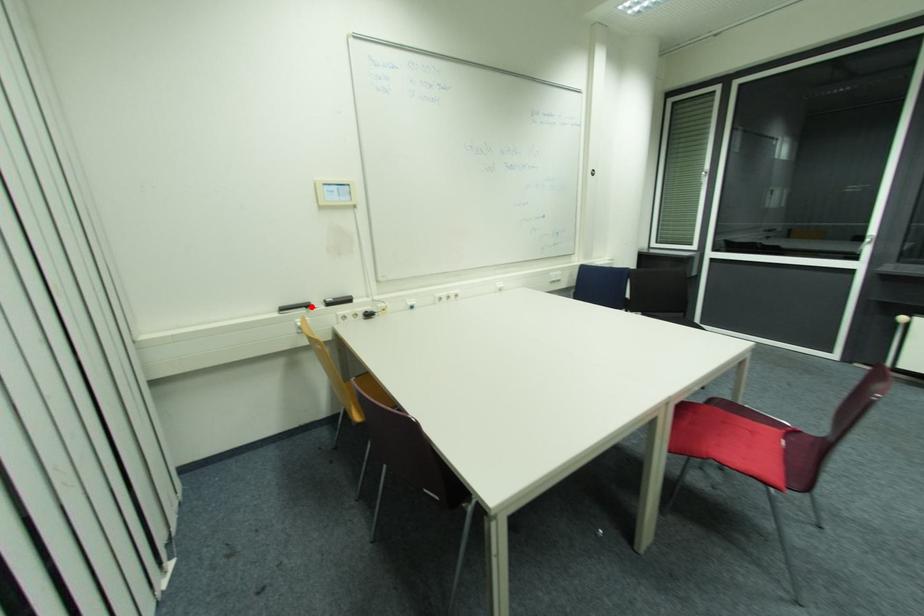
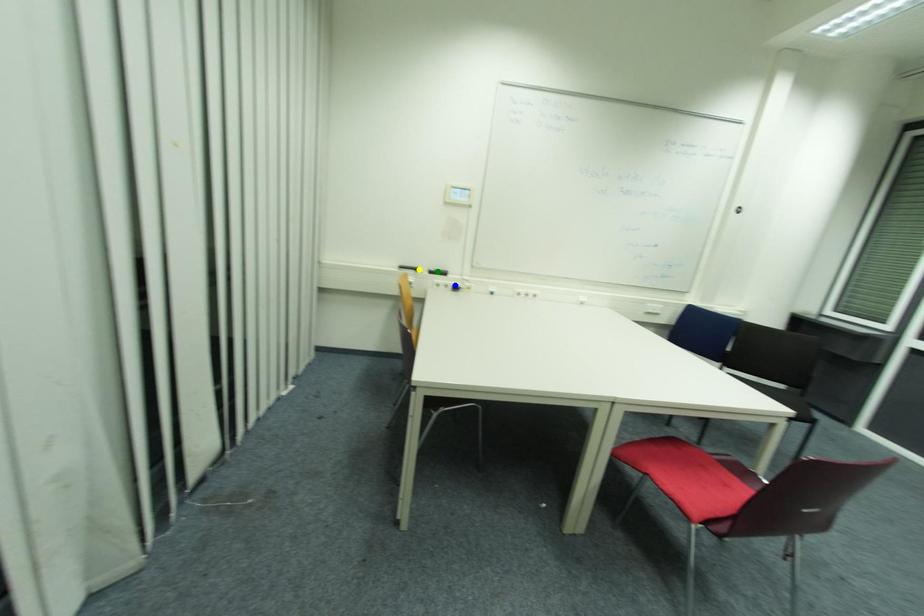
Question: I am providing you with two images of the same scene from different viewpoints. A red point is marked on the first image. You are given multiple points on the second image. Which mark in image 2 goes with the point in image 1?

Choices:
 (A) green point
 (B) yellow point
 (C) blue point

Answer: (B)